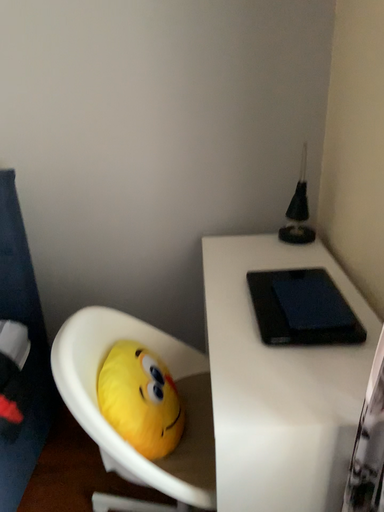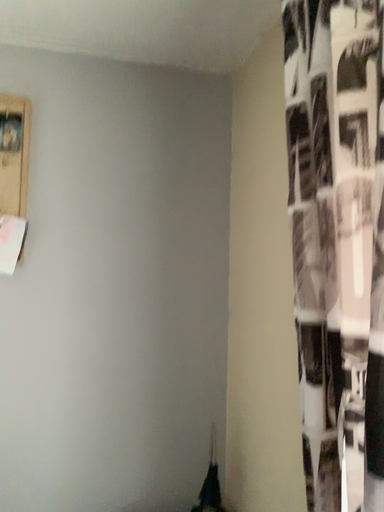
Question: Which way did the camera rotate in the video?

Choices:
 (A) rotated right
 (B) rotated left

Answer: (A)